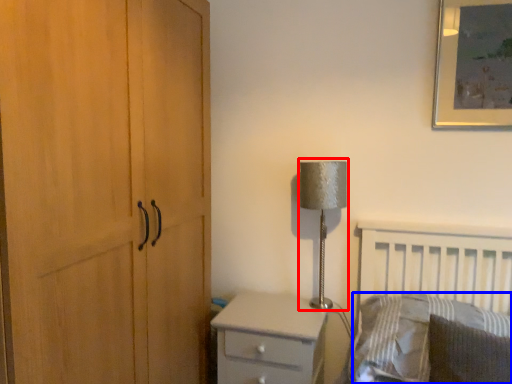
Question: Which object appears farthest to the camera in this image, table lamp (highlighted by a red box) or pillow (highlighted by a blue box)?

Choices:
 (A) table lamp
 (B) pillow

Answer: (A)